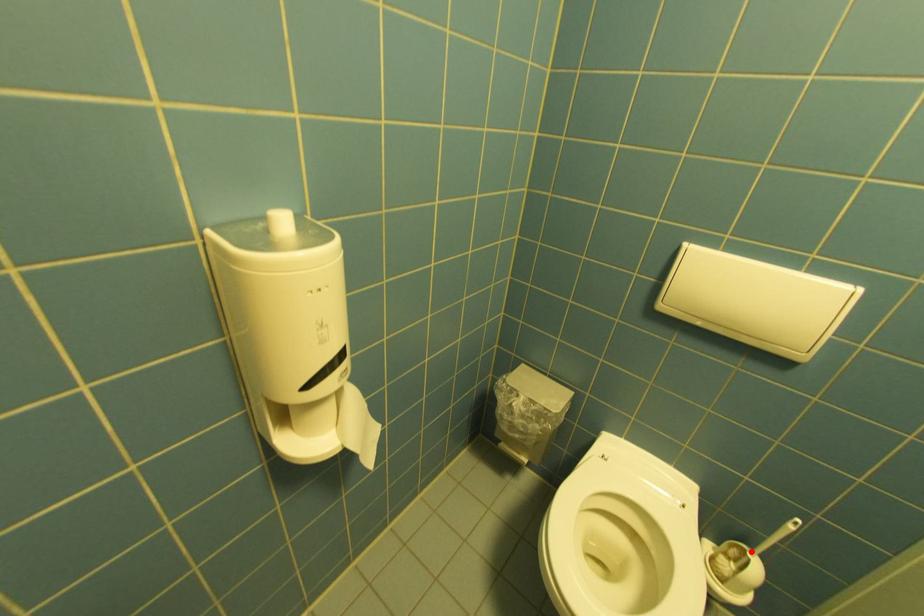
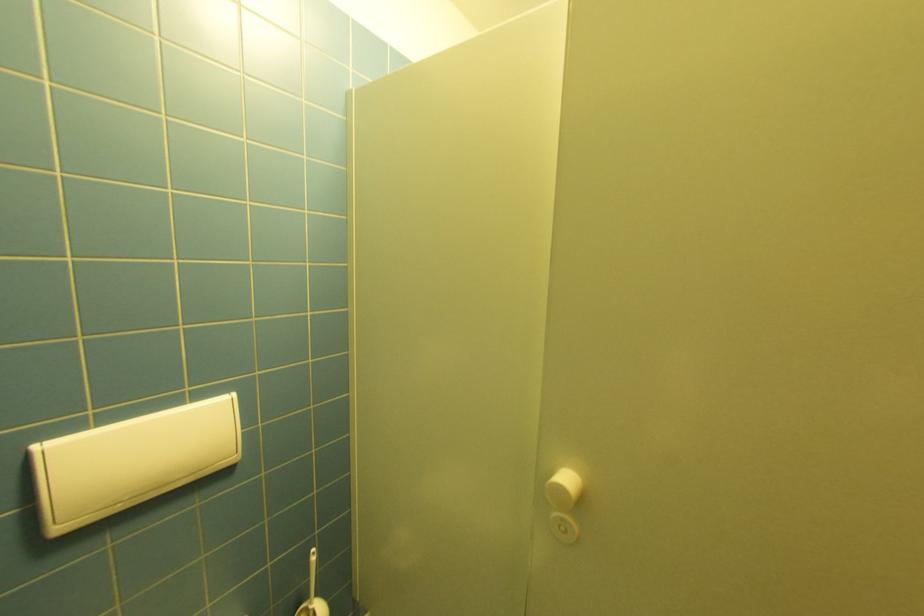
Where in the second image is the point corresponding to the highlighted location from the first image?

(312, 610)